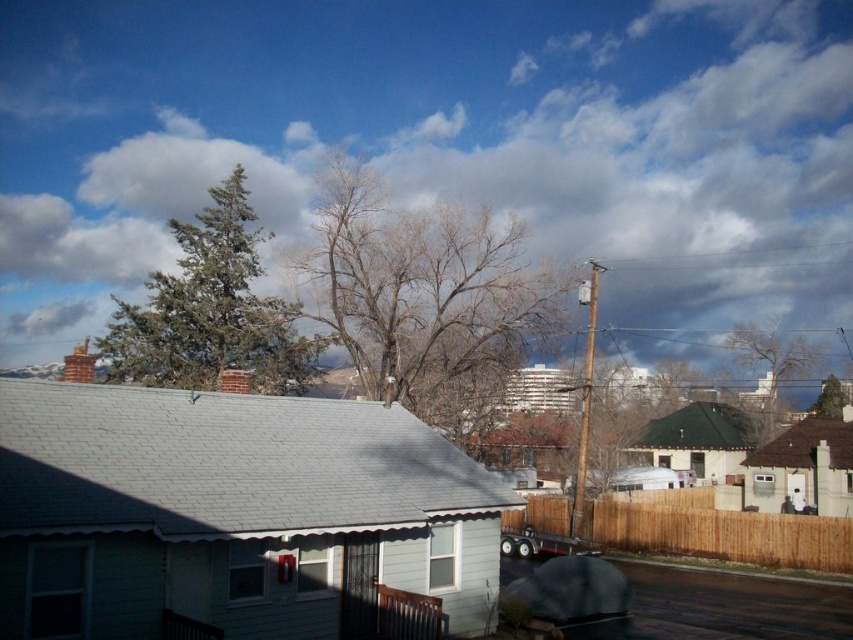
Question: Does green needle-like tree at upper left appear under bare branches at upper right?

Choices:
 (A) yes
 (B) no

Answer: (B)

Question: Which object is positioned closest to the white fluffy cloud at upper center?

Choices:
 (A) bare branches at center
 (B) bare branches at upper right

Answer: (A)

Question: Is green needle-like tree at upper left bigger than bare branches at upper right?

Choices:
 (A) no
 (B) yes

Answer: (B)

Question: Estimate the real-world distances between objects in this image. Which object is farther from the bare branches at center?

Choices:
 (A) white fluffy cloud at upper center
 (B) bare branches at upper right
 (C) green needle-like tree at upper left

Answer: (B)

Question: Is white fluffy cloud at upper center further to camera compared to bare branches at upper right?

Choices:
 (A) no
 (B) yes

Answer: (A)

Question: Which point is closer to the camera?

Choices:
 (A) (468, 108)
 (B) (340, 173)

Answer: (B)